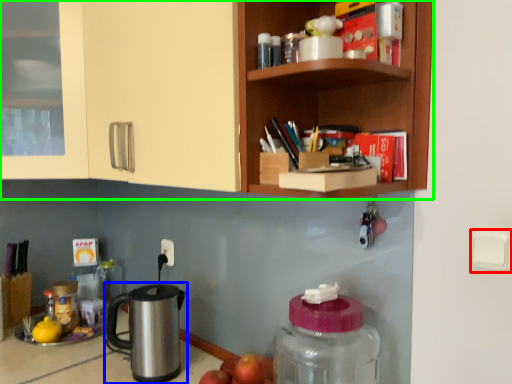
Question: Which object is the farthest from light switch (highlighted by a red box)? Choose among these: kettle (highlighted by a blue box) or cabinetry (highlighted by a green box).

Choices:
 (A) kettle
 (B) cabinetry

Answer: (A)